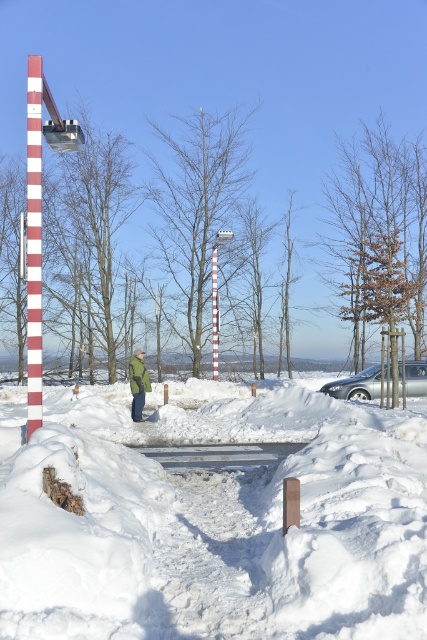
Can you confirm if white fluffy snow at center is smaller than white striped pole at center?

Yes.

Describe the element at coordinates (213, 518) in the screenshot. I see `white fluffy snow at center` at that location.

Who is more forward, (248, 604) or (35, 365)?

Positioned in front is point (248, 604).

Identify the location of white fluffy snow at center. (213, 518).

Who is more forward, (40, 387) or (216, 339)?

Point (40, 387) is in front.

Where is `white striped pole at center`? Image resolution: width=427 pixels, height=640 pixels. white striped pole at center is located at coordinates (34, 243).

Locate an element on the screen. The width and height of the screenshot is (427, 640). white striped pole at center is located at coordinates (34, 243).

Who is higher up, silver metallic car at right or red striped pole at center?

red striped pole at center is higher up.

Is silver metallic car at right below red striped pole at center?

Yes, silver metallic car at right is below red striped pole at center.

Measure the distance between point (325, 385) and camera.

The distance of point (325, 385) from camera is 85.20 feet.

This screenshot has height=640, width=427. What are the coordinates of `silver metallic car at right` in the screenshot? It's located at (359, 385).